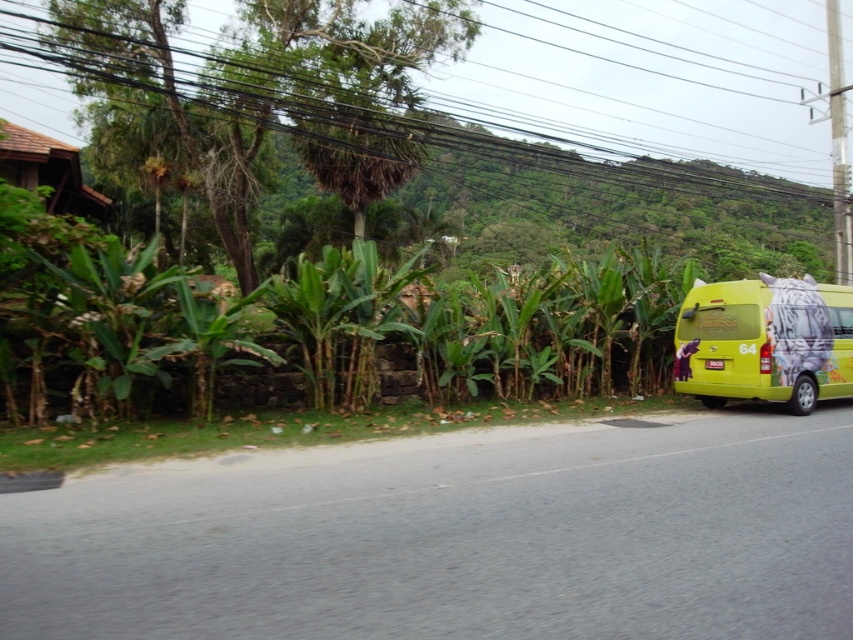
Is green leafy plants at center wider than black wire at upper center?

Result: In fact, green leafy plants at center might be narrower than black wire at upper center.

Is point (79, 323) positioned in front of point (784, 83)?

Yes, it is in front of point (784, 83).

You are a GUI agent. You are given a task and a screenshot of the screen. Output one action in this format:
    pyautogui.click(x=<x>, y=<y>)
    Task: Click on the green leafy plants at center
    Image resolution: width=853 pixels, height=640 pixels.
    Given the screenshot: What is the action you would take?
    pyautogui.click(x=329, y=328)

Between black wire at upper center and yellow matte van at right, which one has less height?

yellow matte van at right

From the picture: Is black wire at upper center to the left of yellow matte van at right from the viewer's perspective?

Yes, black wire at upper center is to the left of yellow matte van at right.

Identify the location of black wire at upper center. (634, 90).

Between point (28, 360) and point (677, 378), which one is positioned in front?

Positioned in front is point (28, 360).

Is green leafy plants at center thinner than yellow matte van at right?

No.

Is point (415, 276) less distant than point (677, 323)?

Yes, it is.

Identify the location of green leafy plants at center. This screenshot has height=640, width=853. (329, 328).